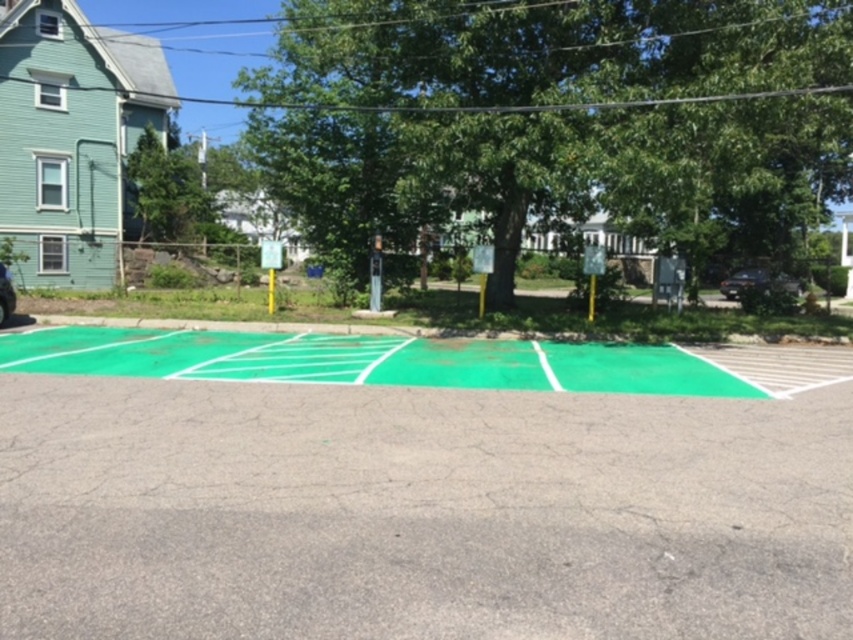
You are standing at point (556, 115) in the parking lot. What object is located exactly at your current position?

At point (556, 115) lies green leafy tree at center.

You are standing in the parking lot looking at the scene. There are two points marked in the image, one at point coordinates point (x=801, y=0) and the other at point coordinates point (x=7, y=269). Which point is closer to you?

Point (x=801, y=0) is closer to the camera than point (x=7, y=269).

You are a delivery person standing next to the shiny blue car at left. You need to deliver a package to the green leafy tree at center. The delivery robot you have can carry packages up to 15 meters. Can your robot deliver the package?

The distance between the green leafy tree at center and the shiny blue car at left is 14.41 meters, so yes, the delivery robot can deliver the package since the distance is within its 15 meters range.